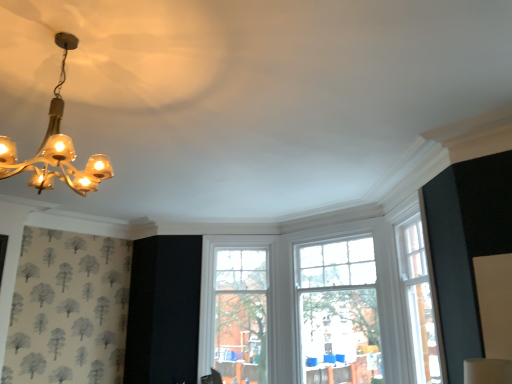
Question: Is clear glass window at center, the second window positioned from the left, looking in the opposite direction of gold glass chandelier at upper left?

Choices:
 (A) yes
 (B) no

Answer: (B)

Question: Considering the relative sizes of clear glass window at center, the 1th window viewed from the right, and gold glass chandelier at upper left in the image provided, is clear glass window at center, the 1th window viewed from the right, shorter than gold glass chandelier at upper left?

Choices:
 (A) no
 (B) yes

Answer: (A)

Question: From the image's perspective, is clear glass window at center, the 1th window viewed from the right, beneath gold glass chandelier at upper left?

Choices:
 (A) yes
 (B) no

Answer: (A)

Question: Does clear glass window at center, the 1th window viewed from the right, touch gold glass chandelier at upper left?

Choices:
 (A) no
 (B) yes

Answer: (A)

Question: Is clear glass window at center, the 1th window viewed from the right, taller than gold glass chandelier at upper left?

Choices:
 (A) no
 (B) yes

Answer: (B)

Question: Is gold glass chandelier at upper left completely or partially inside clear glass window at center, the second window positioned from the left?

Choices:
 (A) no
 (B) yes

Answer: (A)

Question: Can you confirm if clear glass window at center, the second window positioned from the left, is taller than clear glass window at center, which ranks as the 1th window in left-to-right order?

Choices:
 (A) yes
 (B) no

Answer: (B)

Question: Can you confirm if clear glass window at center, the second window positioned from the left, is shorter than clear glass window at center, the second window positioned from the right?

Choices:
 (A) yes
 (B) no

Answer: (A)

Question: Is clear glass window at center, the second window positioned from the left, looking in the opposite direction of clear glass window at center, which ranks as the 1th window in left-to-right order?

Choices:
 (A) no
 (B) yes

Answer: (A)

Question: Could you tell me if clear glass window at center, the 1th window viewed from the right, is turned towards clear glass window at center, which ranks as the 1th window in left-to-right order?

Choices:
 (A) no
 (B) yes

Answer: (A)

Question: Can you confirm if clear glass window at center, the 1th window viewed from the right, is thinner than clear glass window at center, the second window positioned from the right?

Choices:
 (A) yes
 (B) no

Answer: (A)

Question: From a real-world perspective, is clear glass window at center, the 1th window viewed from the right, positioned under clear glass window at center, which ranks as the 1th window in left-to-right order, based on gravity?

Choices:
 (A) yes
 (B) no

Answer: (B)

Question: Is gold glass chandelier at upper left bigger than clear glass window at center, which ranks as the 1th window in left-to-right order?

Choices:
 (A) yes
 (B) no

Answer: (B)